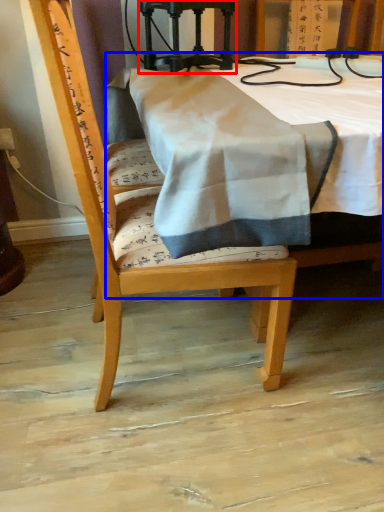
Question: Which point is closer to the camera, equipment (highlighted by a red box) or table (highlighted by a blue box)?

Choices:
 (A) equipment
 (B) table

Answer: (B)